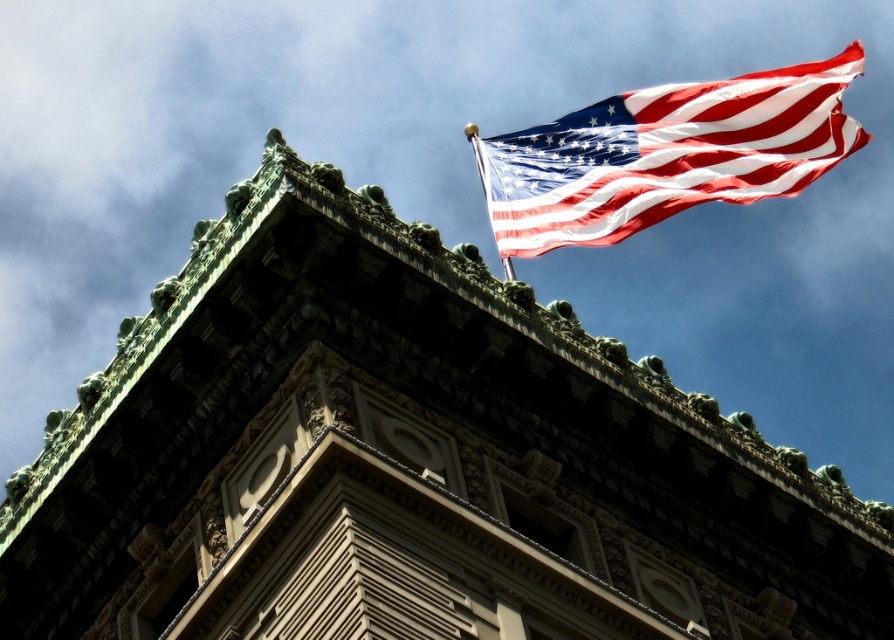
Question: Does red-white striped fabric at upper right appear on the right side of metallic silver flag pole at upper right?

Choices:
 (A) no
 (B) yes

Answer: (B)

Question: Which object appears closest to the camera in this image?

Choices:
 (A) red-white striped fabric at upper right
 (B) metallic silver flag pole at upper right

Answer: (B)

Question: Does red-white striped fabric at upper right come in front of metallic silver flag pole at upper right?

Choices:
 (A) no
 (B) yes

Answer: (A)

Question: Is red-white striped fabric at upper right smaller than metallic silver flag pole at upper right?

Choices:
 (A) yes
 (B) no

Answer: (B)

Question: Which object is farther from the camera taking this photo?

Choices:
 (A) metallic silver flag pole at upper right
 (B) red-white striped fabric at upper right

Answer: (B)